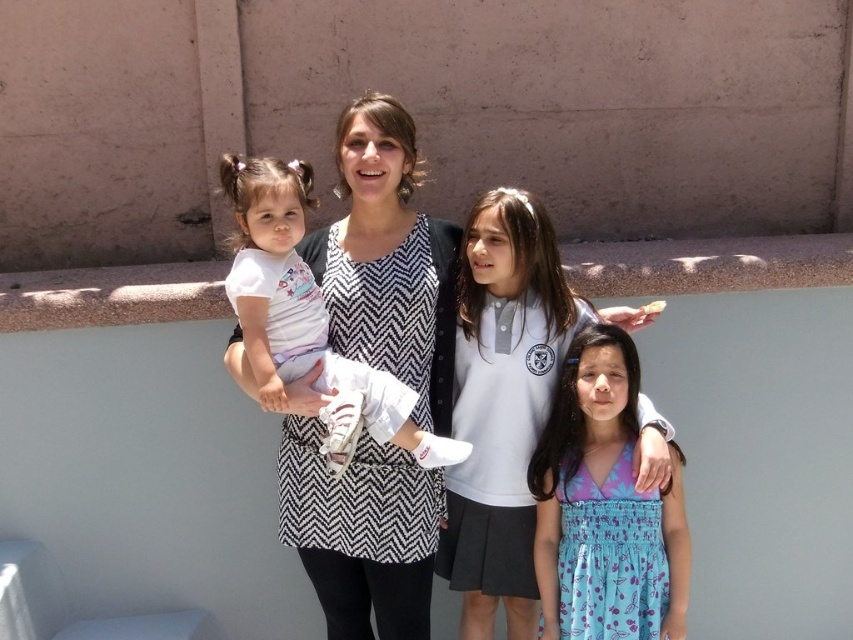
You are a photographer trying to capture a group photo of the family. You notice two girls in the middle ground wearing a white cotton polo shirt at center and a blue floral dress at center. Which girl should you instruct to move forward so that both are visible in the frame?

The blue floral dress at center is behind the white cotton polo shirt at center, so you should instruct the girl wearing the blue floral dress at center to move forward so that both are visible in the frame.

You are standing at the point with coordinates point (294, 243) and want to move to the point with coordinates point (610, 308). Is the destination point behind or in front of your current position?

The point (610, 308) is behind the point (294, 243), so the destination is behind your current position.